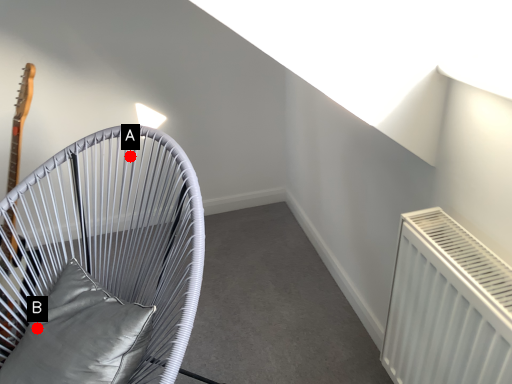
Question: Two points are circled on the image, labeled by A and B beside each circle. Which point is closer to the camera?

Choices:
 (A) A is closer
 (B) B is closer

Answer: (B)